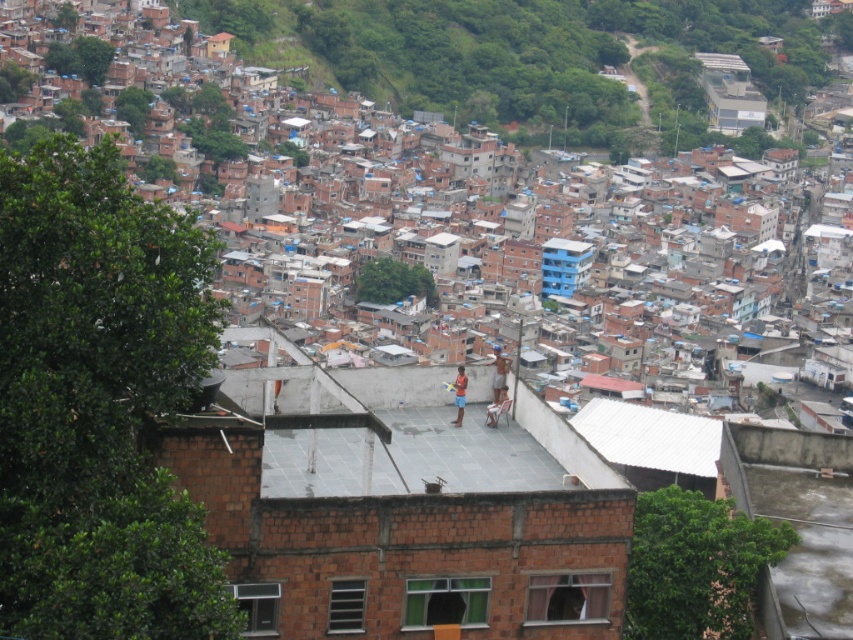
Question: Is brown brick houses at upper left closer to the viewer compared to white corrugated metal roof at center?

Choices:
 (A) no
 (B) yes

Answer: (A)

Question: Which point is closer to the camera?

Choices:
 (A) white corrugated metal roof at center
 (B) brown brick houses at upper left

Answer: (A)

Question: From the image, what is the correct spatial relationship of brown brick houses at upper left in relation to white corrugated metal roof at center?

Choices:
 (A) below
 (B) above

Answer: (B)

Question: Does brown brick houses at upper left come in front of white corrugated metal roof at center?

Choices:
 (A) yes
 (B) no

Answer: (B)